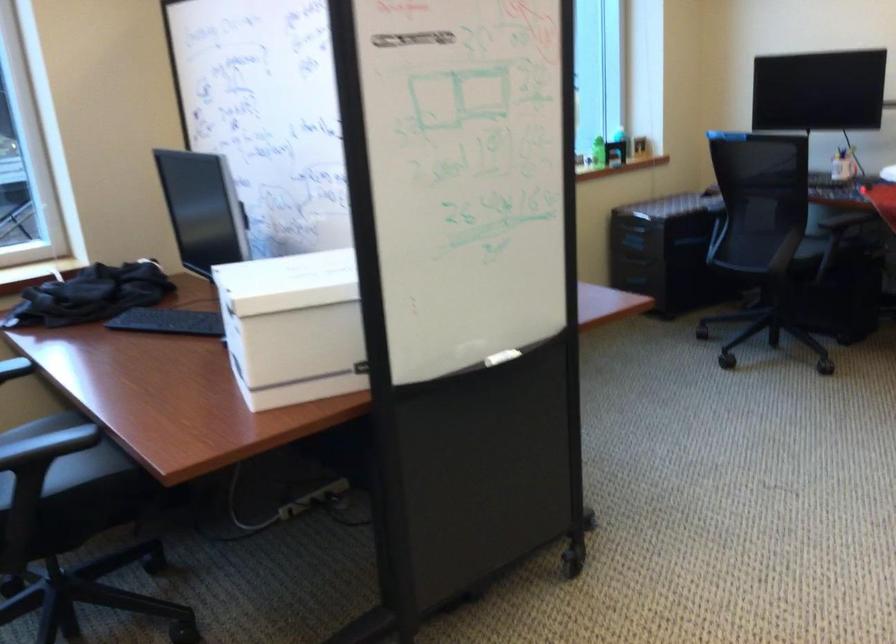
This screenshot has height=644, width=896. I want to click on black keyboard, so click(x=168, y=322).